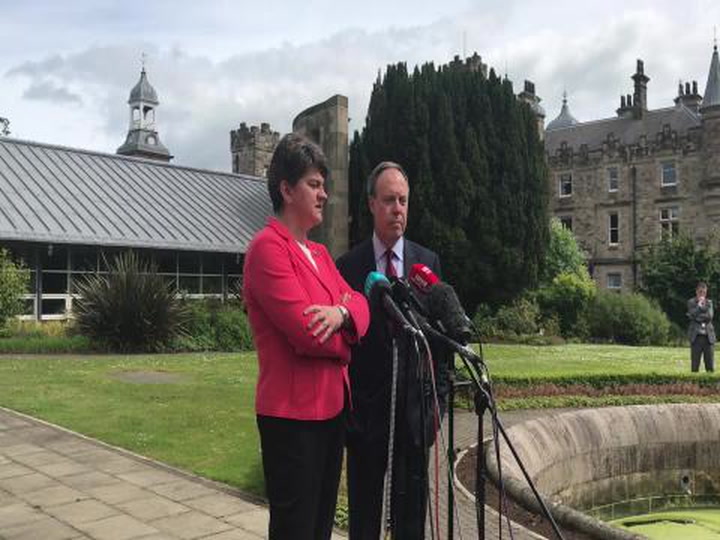
You are a GUI agent. You are given a task and a screenshot of the screen. Output one action in this format:
    pyautogui.click(x=<x>, y=<y>)
    Task: Click on the windows
    
    Given the screenshot: What is the action you would take?
    pyautogui.click(x=667, y=164), pyautogui.click(x=608, y=180), pyautogui.click(x=567, y=181), pyautogui.click(x=612, y=224), pyautogui.click(x=675, y=218), pyautogui.click(x=613, y=280), pyautogui.click(x=49, y=279), pyautogui.click(x=78, y=258), pyautogui.click(x=210, y=264), pyautogui.click(x=193, y=264)